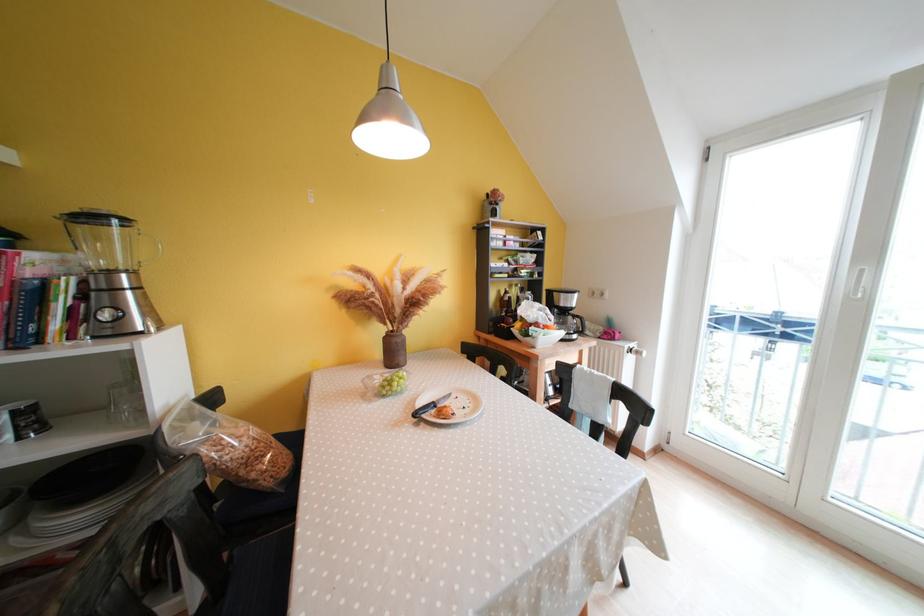
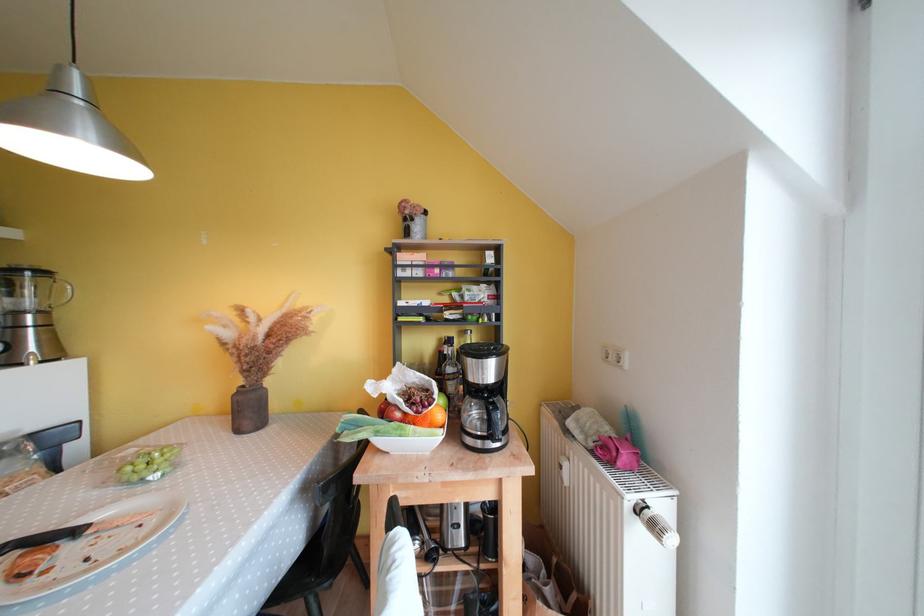
Question: I am providing you with two images of the same scene from different viewpoints. After the viewpoint changes to image2, which objects are now occluded?

Choices:
 (A) glass liquor bottle
 (B) small cardboard box
 (C) chair sitting surface
 (D) none of these

Answer: (D)